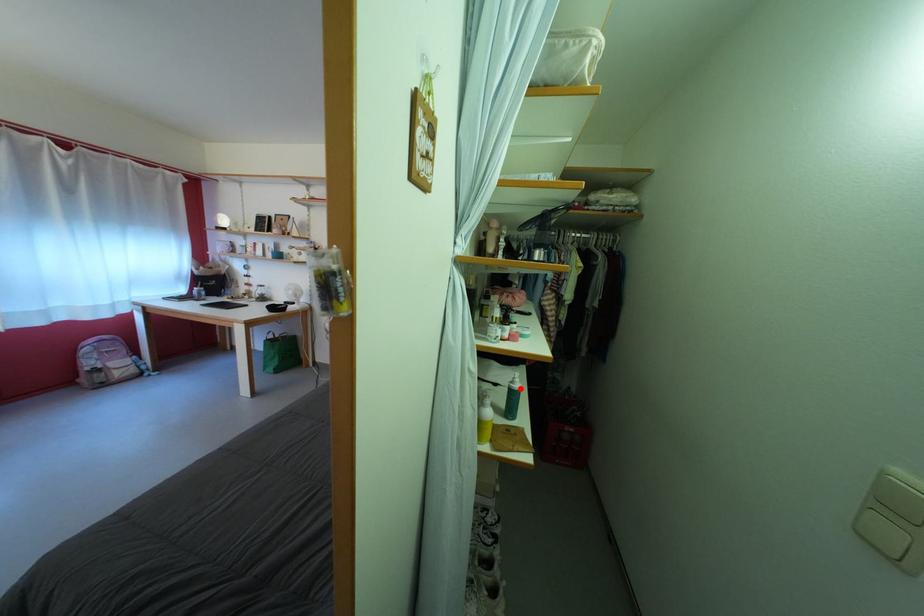
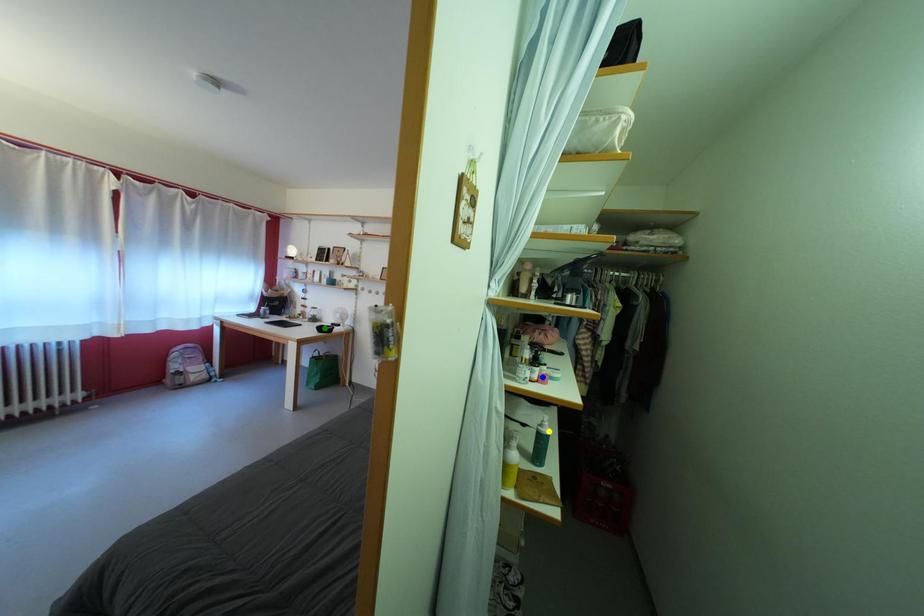
Question: I am providing you with two images of the same scene from different viewpoints. A red point is marked on the first image. You are given multiple points on the second image. Can you choose the point in image 2 that corresponds to the point in image 1?

Choices:
 (A) blue point
 (B) green point
 (C) yellow point

Answer: (C)